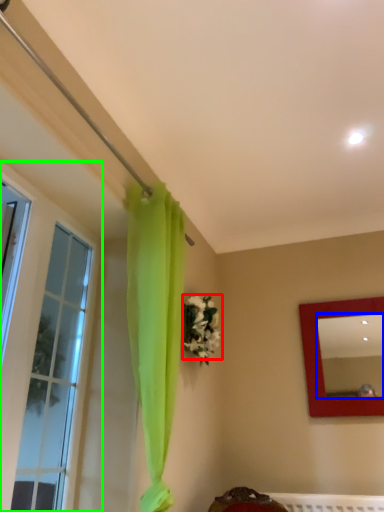
Question: Which object is positioned closest to flower (highlighted by a red box)? Select from mirror (highlighted by a blue box) and window (highlighted by a green box).

Choices:
 (A) mirror
 (B) window

Answer: (B)